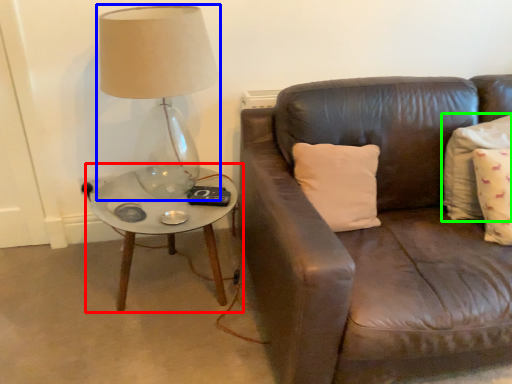
Question: Which object is positioned farthest from coffee table (highlighted by a red box)? Select from lamp (highlighted by a blue box) and pillow (highlighted by a green box).

Choices:
 (A) lamp
 (B) pillow

Answer: (B)